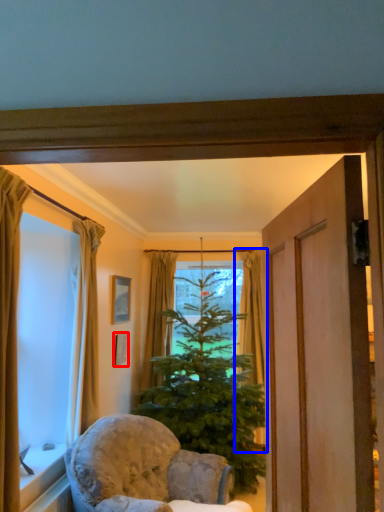
Question: Which object appears closest to the camera in this image, picture frame (highlighted by a red box) or curtain (highlighted by a blue box)?

Choices:
 (A) picture frame
 (B) curtain

Answer: (A)